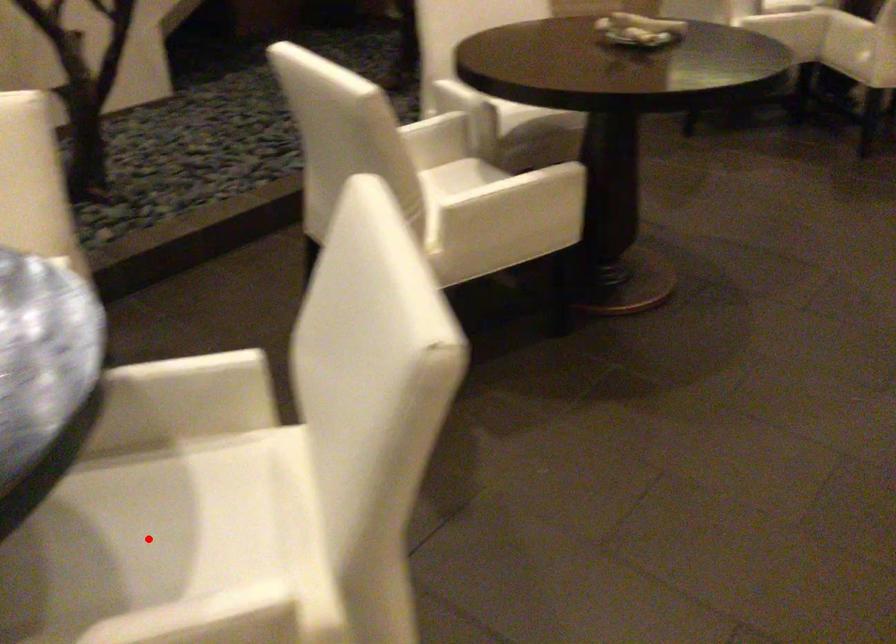
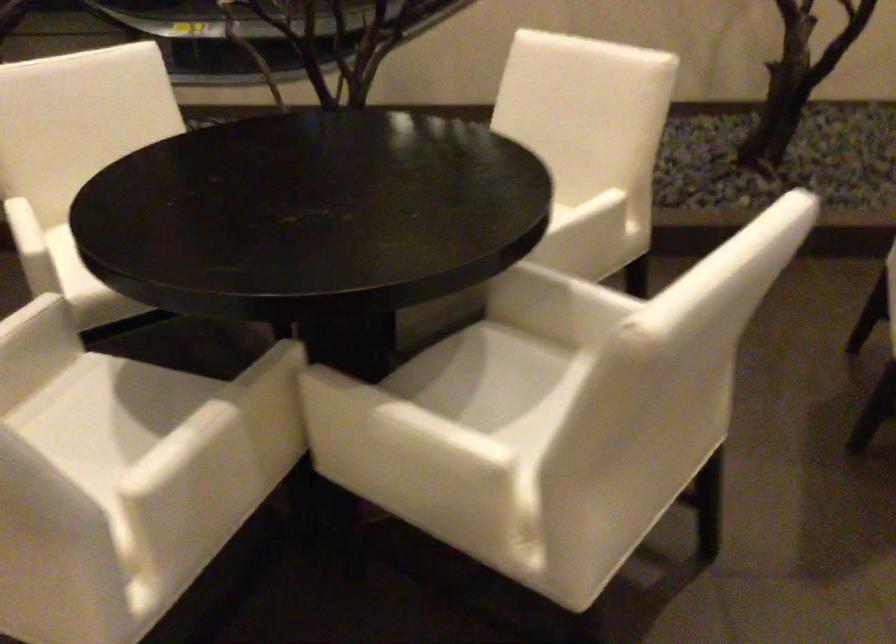
The point at the highlighted location is marked in the first image. Where is the corresponding point in the second image?

(504, 393)